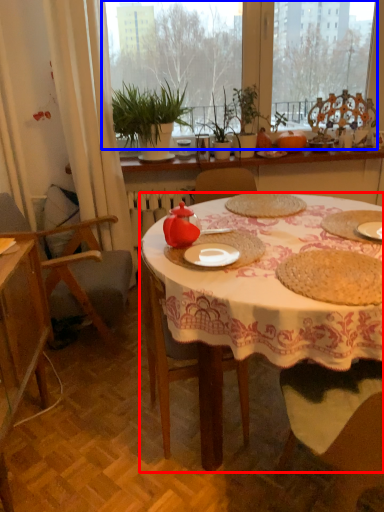
Question: Which object is further to the camera taking this photo, desk (highlighted by a red box) or window screen (highlighted by a blue box)?

Choices:
 (A) desk
 (B) window screen

Answer: (B)